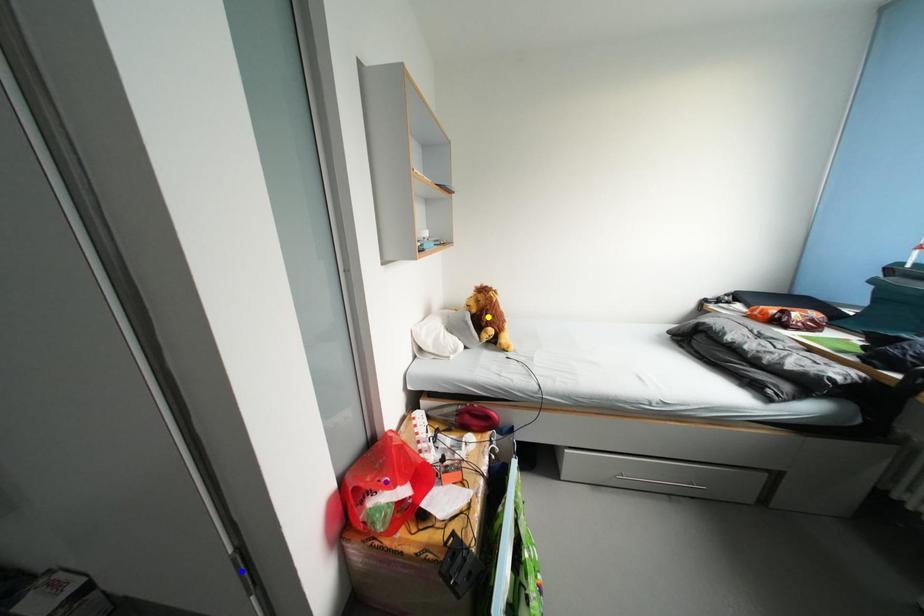
Order these from nearest to farthest:
- yellow point
- blue point
- purple point

blue point
purple point
yellow point